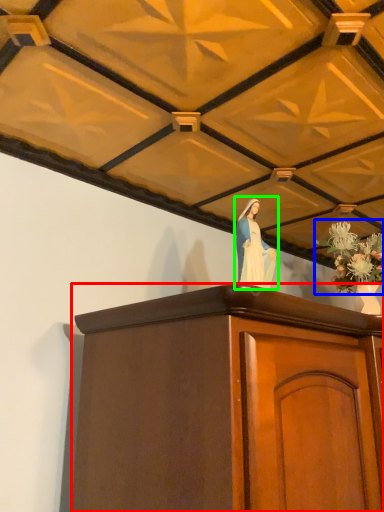
Question: Considering the real-world distances, which object is farthest from furniture (highlighted by a red box)? floral arrangement (highlighted by a blue box) or woman (highlighted by a green box)?

Choices:
 (A) floral arrangement
 (B) woman

Answer: (A)